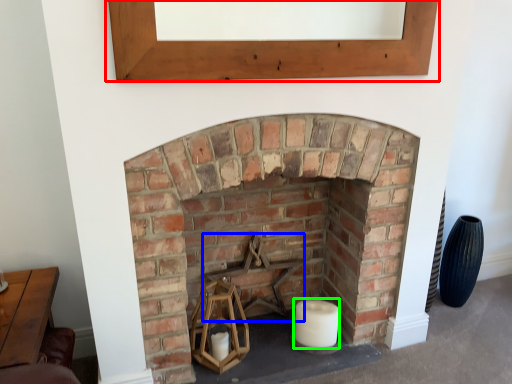
Question: Which is nearer to the window frame (highlighted by a red box)? armchair (highlighted by a blue box) or candle (highlighted by a green box).

Choices:
 (A) armchair
 (B) candle

Answer: (A)